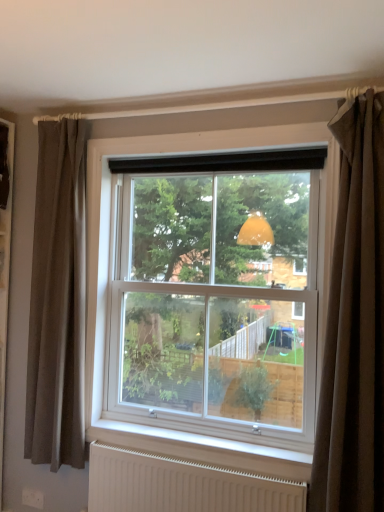
Question: From a real-world perspective, is brown fabric curtain at right, positioned as the second curtain in back-to-front order, positioned above or below white matte radiator at lower center?

Choices:
 (A) above
 (B) below

Answer: (A)

Question: Does point (367, 295) appear closer or farther from the camera than point (218, 504)?

Choices:
 (A) farther
 (B) closer

Answer: (B)

Question: Which object is positioned closest to the brown fabric curtain at right, positioned as the second curtain in back-to-front order?

Choices:
 (A) white plastic window at center
 (B) brown fabric curtain at left, which ranks as the second curtain in front-to-back order
 (C) white matte radiator at lower center

Answer: (A)

Question: Which of these objects is positioned closest to the white plastic window at center?

Choices:
 (A) white matte radiator at lower center
 (B) brown fabric curtain at left, which ranks as the 2th curtain in right-to-left order
 (C) brown fabric curtain at right, the second curtain from the left

Answer: (B)